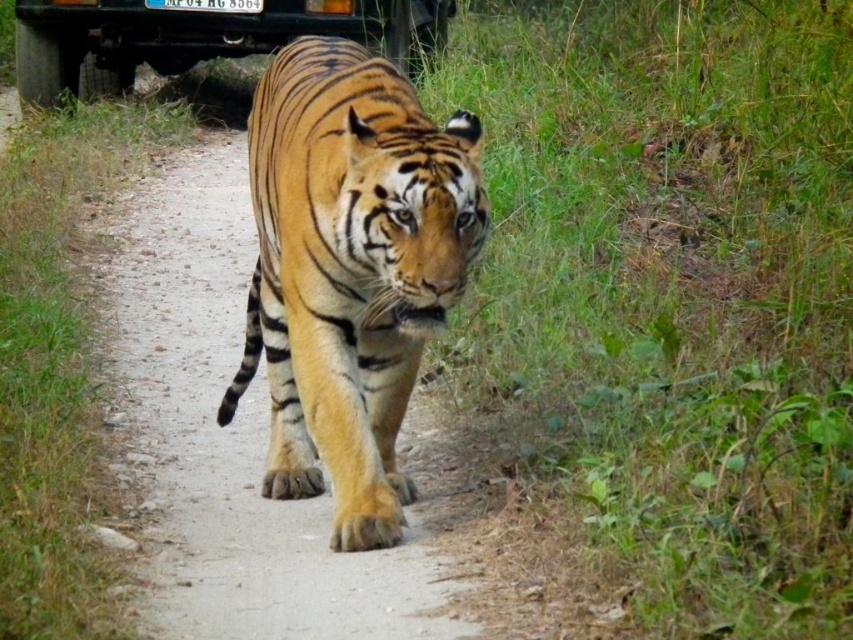
Looking at this image, does orange-yellow fur tiger at center appear on the right side of metallic black truck at upper center?

Yes, orange-yellow fur tiger at center is to the right of metallic black truck at upper center.

Is the position of orange-yellow fur tiger at center more distant than that of metallic black truck at upper center?

No, orange-yellow fur tiger at center is closer to the viewer.

Is point (405, 145) positioned in front of point (122, 33)?

Yes, point (405, 145) is closer to viewer.

At what (x,y) coordinates should I click in order to perform the action: click on orange-yellow fur tiger at center. Please return your answer as a coordinate pair (x, y). The image size is (853, 640). Looking at the image, I should click on (350, 269).